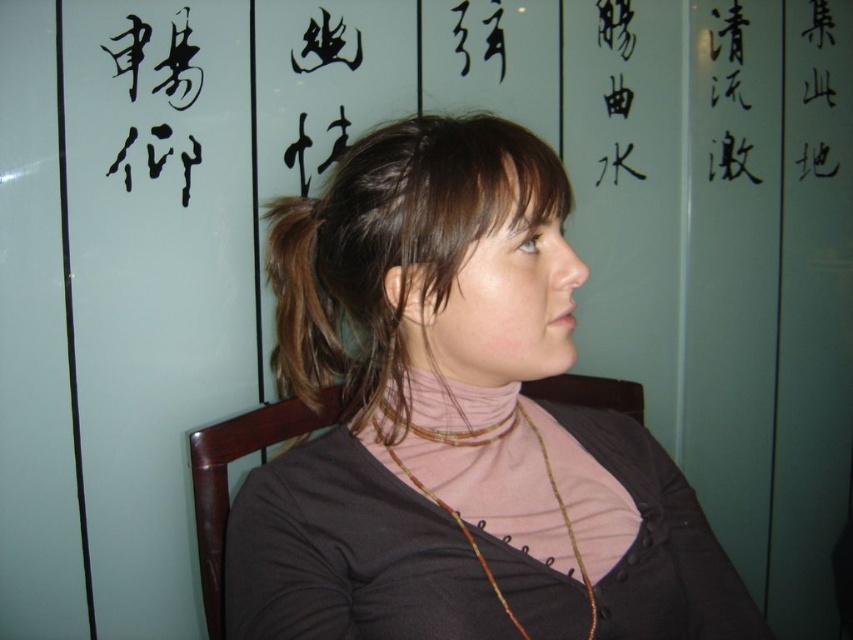
Question: Is brown shiny hair at upper left to the left of matte gold necklace at center from the viewer's perspective?

Choices:
 (A) yes
 (B) no

Answer: (A)

Question: Does brown wood chair at center have a greater width compared to multicolored beaded necklace at center?

Choices:
 (A) no
 (B) yes

Answer: (A)

Question: Estimate the real-world distances between objects in this image. Which object is farther from the matte gold necklace at center?

Choices:
 (A) multicolored beaded necklace at center
 (B) brown wood chair at center
 (C) matte brown hair at center

Answer: (B)

Question: Based on their relative distances, which object is farther from the brown woven necklace at center?

Choices:
 (A) matte brown hair at center
 (B) brown wood chair at center
 (C) brown shiny hair at upper left
 (D) multicolored beaded necklace at center

Answer: (B)

Question: Which point appears farthest from the camera in this image?

Choices:
 (A) (457, 120)
 (B) (469, 323)
 (C) (424, 134)

Answer: (A)

Question: Does matte brown hair at center appear under multicolored beaded necklace at center?

Choices:
 (A) yes
 (B) no

Answer: (B)